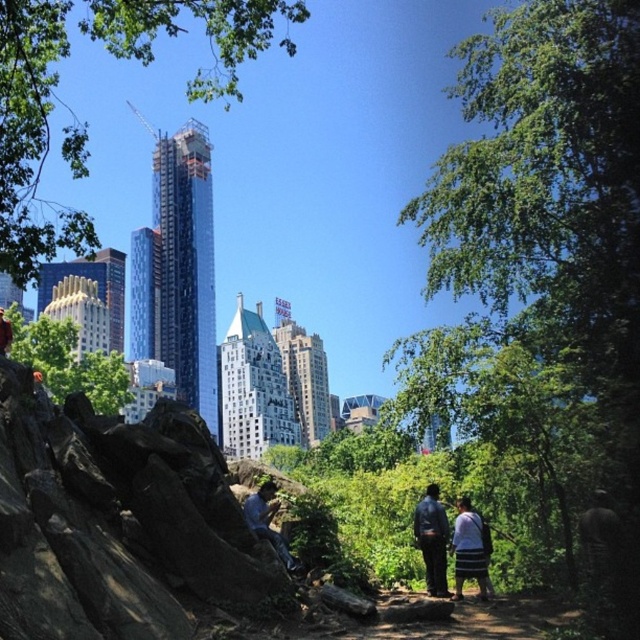
Does striped fabric skirt at lower center have a larger size compared to blue denim jeans at center?

No, striped fabric skirt at lower center is not bigger than blue denim jeans at center.

This screenshot has height=640, width=640. What do you see at coordinates (470, 548) in the screenshot?
I see `striped fabric skirt at lower center` at bounding box center [470, 548].

Measure the distance between striped fabric skirt at lower center and camera.

61.22 meters

Where is `striped fabric skirt at lower center`? This screenshot has height=640, width=640. striped fabric skirt at lower center is located at coordinates (470, 548).

Measure the distance from dark blue leather jacket at center to blue denim jeans at center.

dark blue leather jacket at center and blue denim jeans at center are 13.36 meters apart.

Is dark blue leather jacket at center to the left of blue denim jeans at center from the viewer's perspective?

In fact, dark blue leather jacket at center is to the right of blue denim jeans at center.

Between point (428, 528) and point (273, 532), which one is positioned behind?

The point (428, 528) is behind.

Identify the location of dark blue leather jacket at center. coord(433,540).

Between green leafy tree at upper left and blue denim jeans at center, which one has less height?

blue denim jeans at center is shorter.

Who is positioned more to the left, green leafy tree at upper left or blue denim jeans at center?

Positioned to the left is green leafy tree at upper left.

Between point (228, 22) and point (269, 493), which one is positioned in front?

Point (269, 493) is in front.

You are a GUI agent. You are given a task and a screenshot of the screen. Output one action in this format:
    pyautogui.click(x=<x>, y=<y>)
    Task: Click on the green leafy tree at upper left
    Image resolution: width=640 pixels, height=640 pixels.
    Given the screenshot: What is the action you would take?
    pyautogui.click(x=32, y=136)